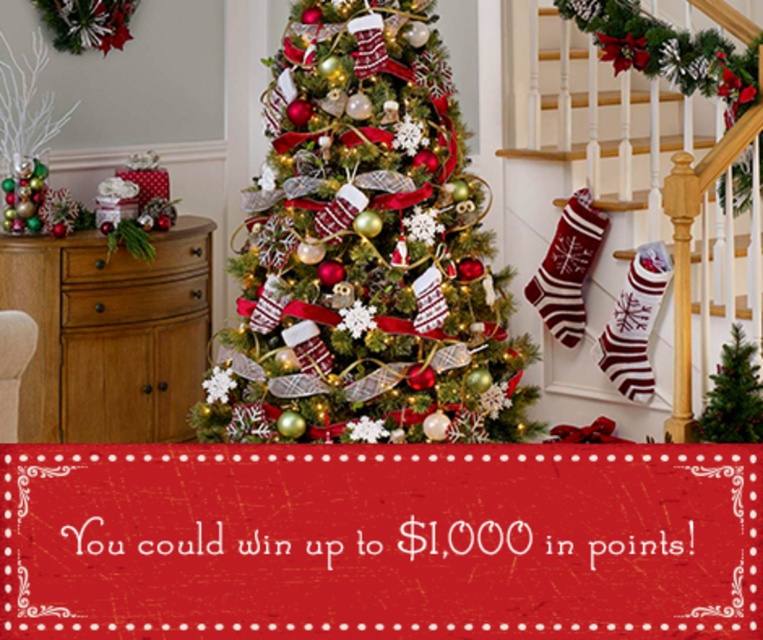
Question: Is shiny green christmas tree at center wider than striped wool stocking at right?

Choices:
 (A) yes
 (B) no

Answer: (A)

Question: Is striped wool stocking at right positioned at the back of green matte christmas tree at center?

Choices:
 (A) no
 (B) yes

Answer: (B)

Question: Which point is closer to the camera?

Choices:
 (A) striped wool stocking at right
 (B) knit red and white striped stocking at right

Answer: (A)

Question: Does shiny green christmas tree at center appear on the right side of striped wool stocking at right?

Choices:
 (A) yes
 (B) no

Answer: (B)

Question: Which of the following is the farthest from the observer?

Choices:
 (A) striped wool stocking at right
 (B) knit stockings at center
 (C) knit red and white striped stocking at right

Answer: (C)

Question: Which object is the farthest from the knit stockings at center?

Choices:
 (A) knit red and white striped stocking at right
 (B) striped wool stocking at right

Answer: (B)